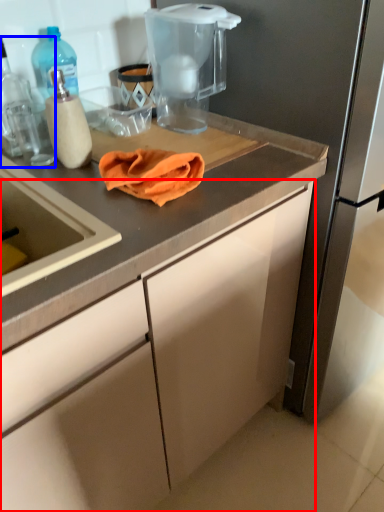
Question: Which object is further to the camera taking this photo, cabinetry (highlighted by a red box) or kitchen appliance (highlighted by a blue box)?

Choices:
 (A) cabinetry
 (B) kitchen appliance

Answer: (B)